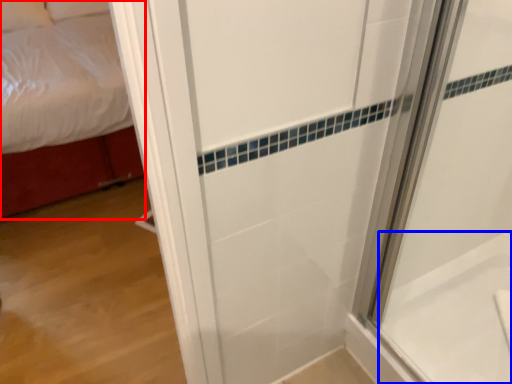
Question: Which object appears closest to the camera in this image, bed (highlighted by a red box) or bath (highlighted by a blue box)?

Choices:
 (A) bed
 (B) bath

Answer: (B)